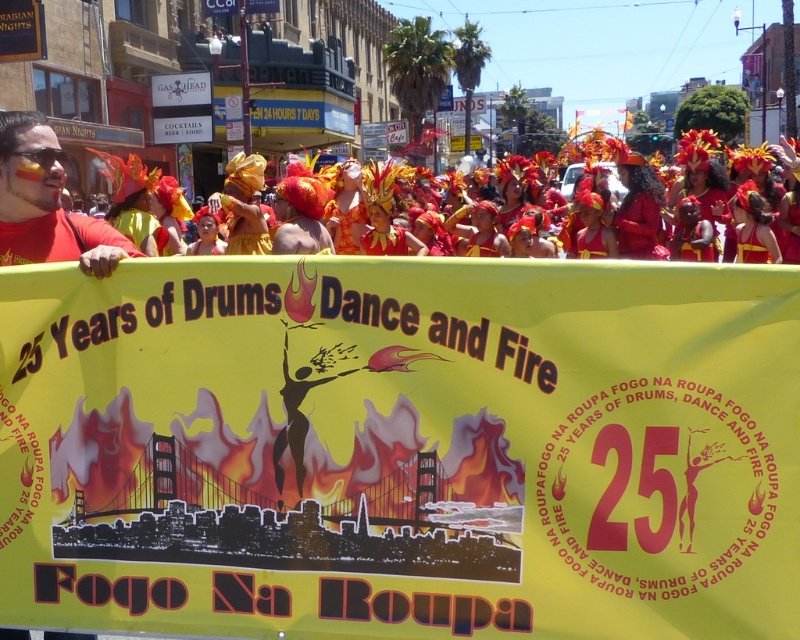
Does yellow paper banner at center have a greater height compared to matte red shirt at left?

Incorrect, yellow paper banner at center's height is not larger of matte red shirt at left's.

Is yellow paper banner at center shorter than matte red shirt at left?

Yes, yellow paper banner at center is shorter than matte red shirt at left.

Describe the element at coordinates (401, 448) in the screenshot. I see `yellow paper banner at center` at that location.

You are a GUI agent. You are given a task and a screenshot of the screen. Output one action in this format:
    pyautogui.click(x=<x>, y=<y>)
    Task: Click on the yellow paper banner at center
    Image resolution: width=800 pixels, height=640 pixels.
    Given the screenshot: What is the action you would take?
    point(401,448)

Between yellow paper banner at center and matte red costume at center, which one is positioned lower?

Positioned lower is yellow paper banner at center.

Is point (418, 563) in front of point (658, 205)?

Yes, it is in front of point (658, 205).

Identify the location of yellow paper banner at center. The width and height of the screenshot is (800, 640). (401, 448).

Looking at this image, can you confirm if matte red shirt at lower left is shorter than shiny gold headpiece at upper right?

No, matte red shirt at lower left is not shorter than shiny gold headpiece at upper right.

Between point (46, 204) and point (764, 259), which one is positioned in front?

Point (46, 204)

Is point (68, 244) less distant than point (762, 259)?

Yes, point (68, 244) is closer to viewer.

At what (x,y) coordinates should I click in order to perform the action: click on matte red shirt at lower left. Please return your answer as a coordinate pair (x, y). Looking at the image, I should click on (46, 204).